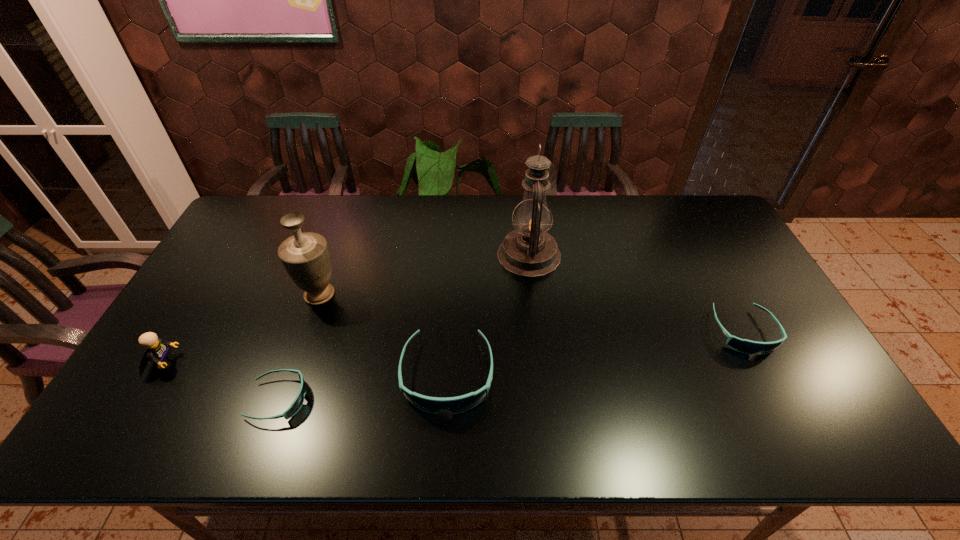
You are a GUI agent. You are given a task and a screenshot of the screen. Output one action in this format:
    pyautogui.click(x=<x>, y=<y>)
    Task: Click on the object positioned at the near left corner
    
    Given the screenshot: What is the action you would take?
    pyautogui.click(x=157, y=351)

In the image, there is a desktop. Where is `vacant area at the far edge`? The width and height of the screenshot is (960, 540). vacant area at the far edge is located at coordinates (306, 228).

This screenshot has width=960, height=540. In the image, there is a desktop. What are the coordinates of `vacant space at the near edge` in the screenshot? It's located at (572, 375).

In the image, there is a desktop. Find the location of `vacant space at the left edge`. vacant space at the left edge is located at coordinates (249, 265).

Where is `free location at the right edge of the desktop`? free location at the right edge of the desktop is located at coordinates (764, 292).

Find the location of a particular element. vacant space at the far left corner of the desktop is located at coordinates (247, 233).

This screenshot has height=540, width=960. Identify the location of free spot at the far right corner of the desktop. (702, 230).

Locate an element on the screen. free space between the rightmost sunglasses and the leftmost sunglasses is located at coordinates (511, 366).

In order to click on free space between the fourth tallest object and the tallest object in this screenshot , I will do `click(488, 315)`.

Locate an element on the screen. The height and width of the screenshot is (540, 960). unoccupied area between the second tallest sunglasses and the farthest object is located at coordinates (636, 293).